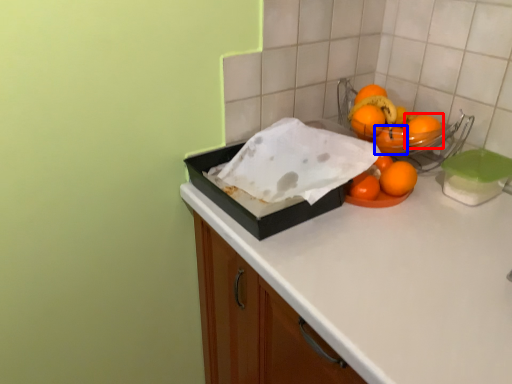
Question: Which object appears farthest to the camera in this image, orange (highlighted by a red box) or orange (highlighted by a blue box)?

Choices:
 (A) orange
 (B) orange

Answer: (B)